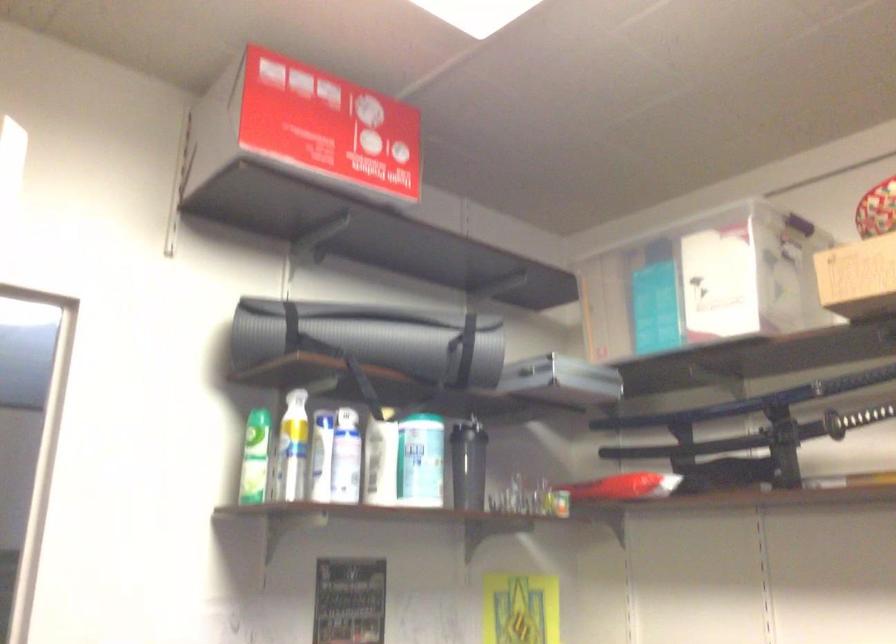
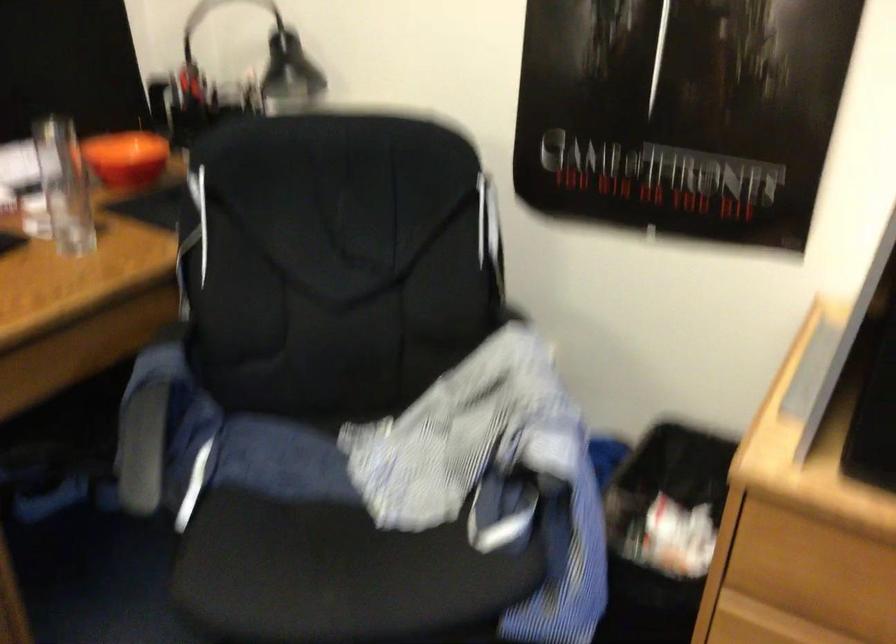
First-person continuous shooting, in which direction is the camera rotating?

The rotation direction of the camera is right-down.